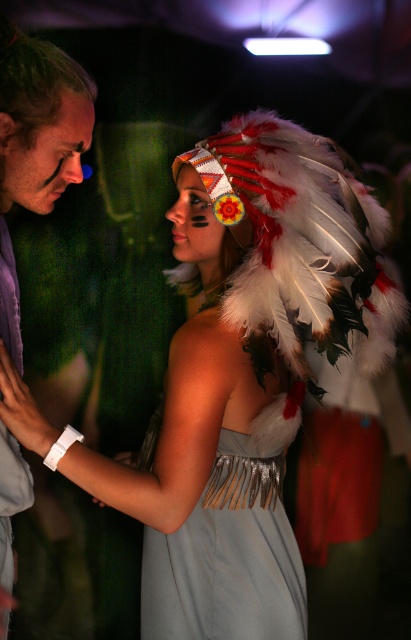
Question: Among these points, which one is nearest to the camera?

Choices:
 (A) click(304, 166)
 (B) click(223, 570)
 (C) click(60, 177)

Answer: (C)

Question: Which of the following is the closest to the observer?

Choices:
 (A) (23, 195)
 (B) (226, 317)

Answer: (B)

Question: Is satin silver dress at center thinner than matte purple shirt at left?

Choices:
 (A) no
 (B) yes

Answer: (A)

Question: Can you confirm if white feather headdress at upper center is wider than satin silver dress at center?

Choices:
 (A) yes
 (B) no

Answer: (A)

Question: Which object is the farthest from the white feather headdress at upper center?

Choices:
 (A) matte purple shirt at left
 (B) satin silver dress at center

Answer: (A)

Question: Is white feather headdress at upper center bigger than matte purple shirt at left?

Choices:
 (A) yes
 (B) no

Answer: (A)